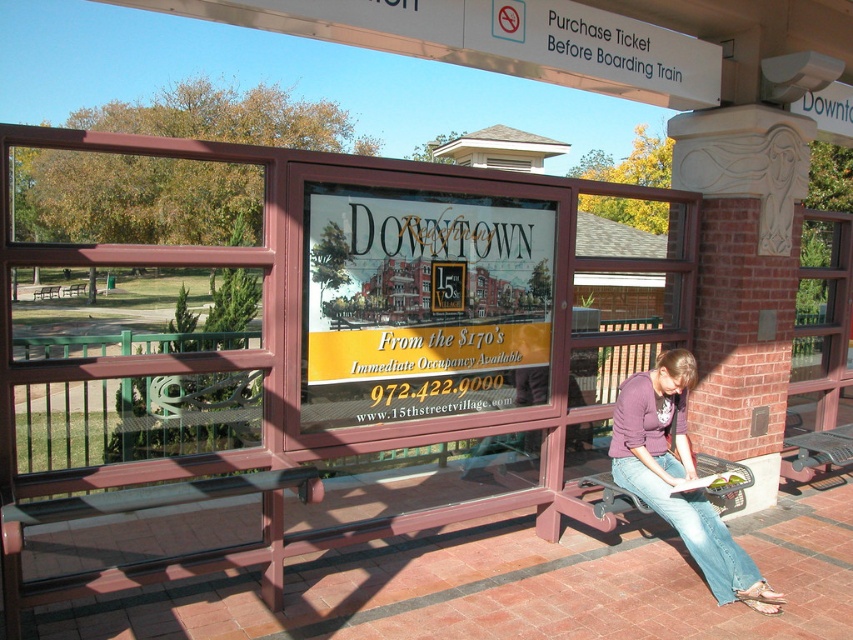
Who is taller, purple soft sweater at lower right or metallic gray bench at lower right?

purple soft sweater at lower right is taller.

Is purple soft sweater at lower right to the right of metallic gray bench at lower right from the viewer's perspective?

Incorrect, purple soft sweater at lower right is not on the right side of metallic gray bench at lower right.

Who is more forward, (643,456) or (830,429)?

Point (643,456) is in front.

Find the location of `purple soft sweater at lower right`. purple soft sweater at lower right is located at coordinates (679, 477).